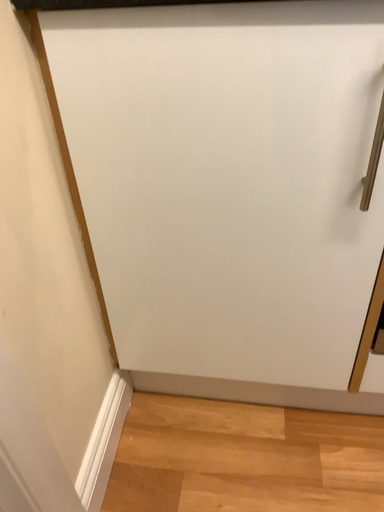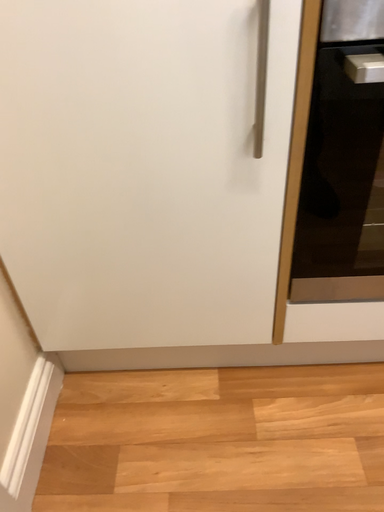
Question: How did the camera likely rotate when shooting the video?

Choices:
 (A) rotated left
 (B) rotated right

Answer: (B)